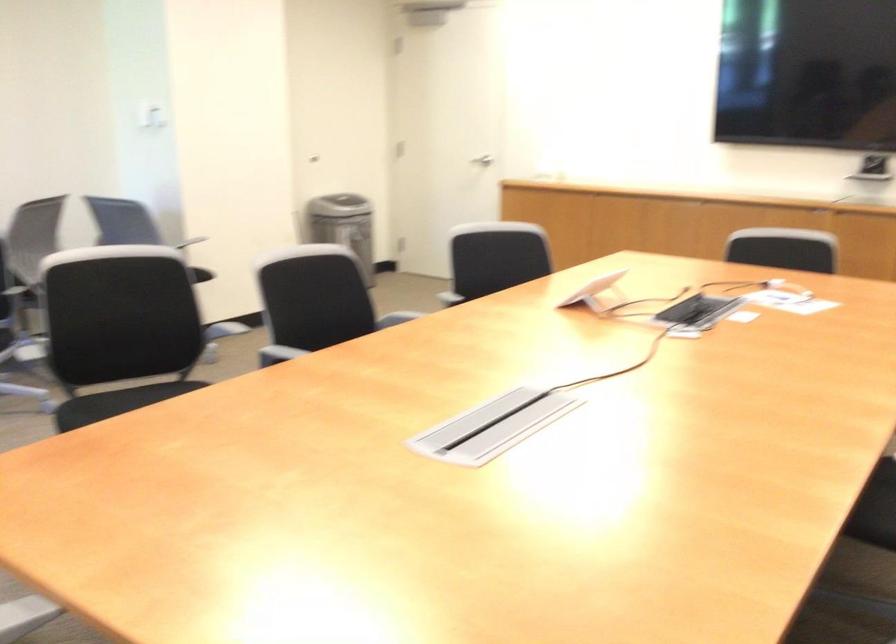
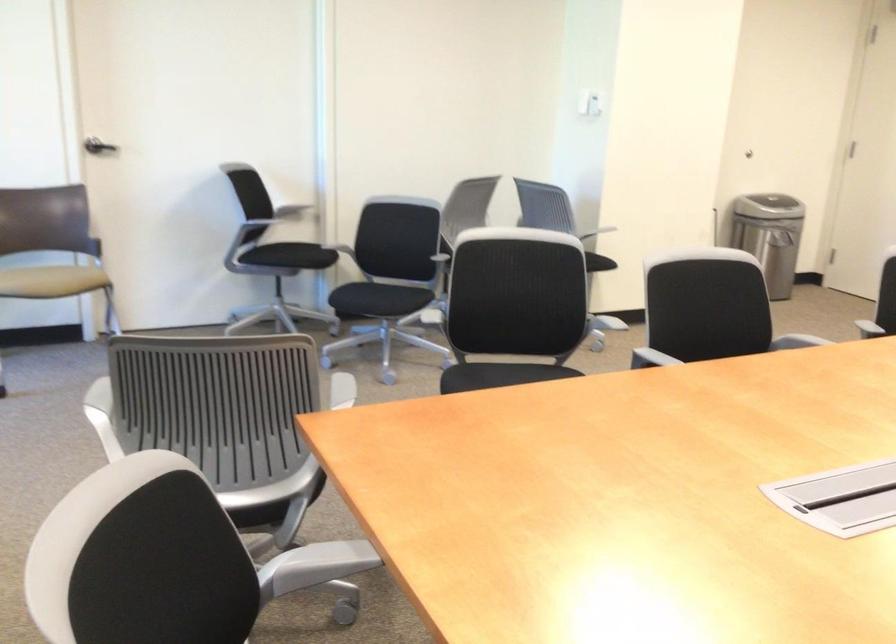
Question: The camera is either moving clockwise (left) or counter-clockwise (right) around the object. The first image is from the beginning of the video and the second image is from the end. Is the camera moving left or right when shooting the video?

Choices:
 (A) Left
 (B) Right

Answer: (B)